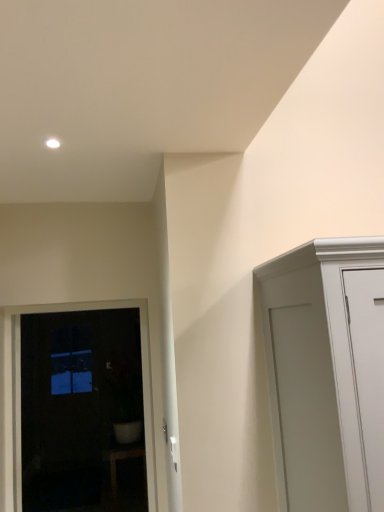
Question: Is white glossy pot at lower left spatially inside dark glass door at left, or outside of it?

Choices:
 (A) inside
 (B) outside

Answer: (B)

Question: In the image, is white glossy pot at lower left positioned in front of or behind dark glass door at left?

Choices:
 (A) behind
 (B) front

Answer: (A)

Question: Does point (112, 485) appear closer or farther from the camera than point (147, 458)?

Choices:
 (A) farther
 (B) closer

Answer: (A)

Question: From a real-world perspective, is dark glass door at left physically located above or below white glossy pot at lower left?

Choices:
 (A) below
 (B) above

Answer: (B)

Question: Is dark glass door at left bigger or smaller than white glossy pot at lower left?

Choices:
 (A) small
 (B) big

Answer: (A)

Question: Visually, is dark glass door at left positioned to the left or to the right of white glossy pot at lower left?

Choices:
 (A) left
 (B) right

Answer: (A)

Question: In the image, is dark glass door at left positioned in front of or behind white glossy pot at lower left?

Choices:
 (A) front
 (B) behind

Answer: (A)